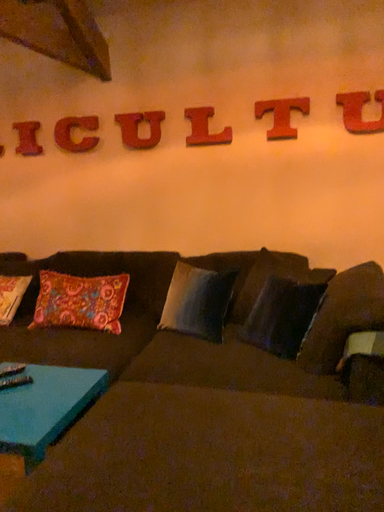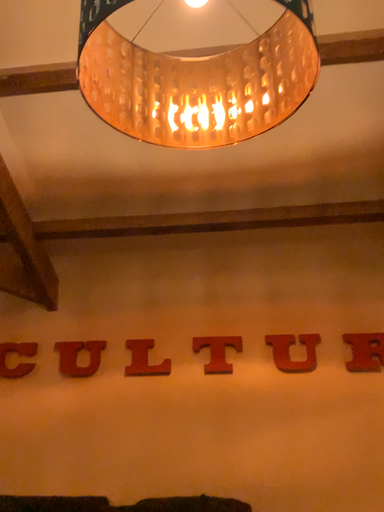
Question: Which way did the camera rotate in the video?

Choices:
 (A) rotated downward
 (B) rotated upward

Answer: (B)